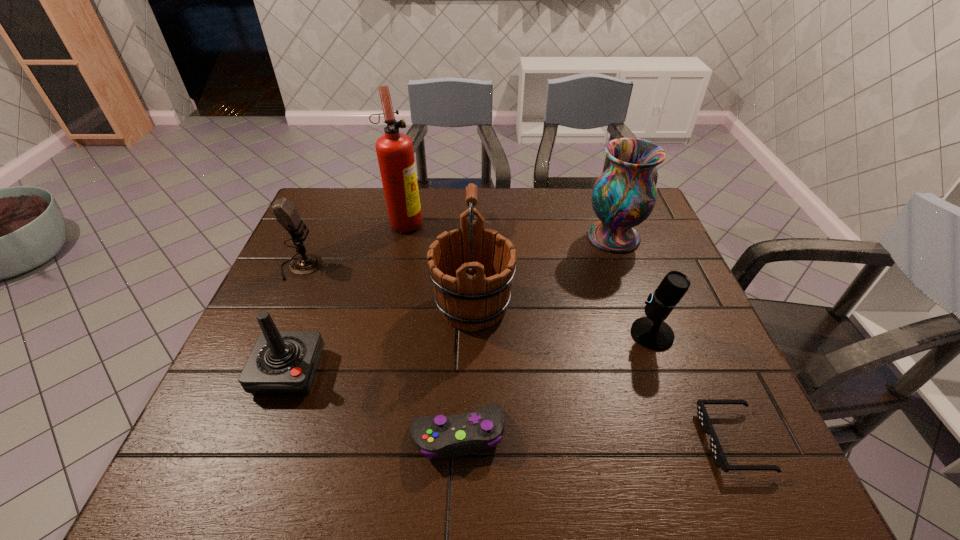
Where is `vacant space located 0.150m on the front of the sixth shortest object`? vacant space located 0.150m on the front of the sixth shortest object is located at coordinates (633, 292).

Where is `free space located on the front-facing side of the farther microphone`? Image resolution: width=960 pixels, height=540 pixels. free space located on the front-facing side of the farther microphone is located at coordinates (409, 267).

You are a GUI agent. You are given a task and a screenshot of the screen. Output one action in this format:
    pyautogui.click(x=<x>, y=<y>)
    Task: Click on the free space located 0.310m on the front of the nearer microphone
    
    Given the screenshot: What is the action you would take?
    pyautogui.click(x=708, y=485)

At what (x,y) coordinates should I click in order to perform the action: click on free space located 0.070m on the front-facing side of the joystick. Please return your answer as a coordinate pair (x, y). This screenshot has height=540, width=960. Looking at the image, I should click on click(267, 429).

Identify the location of blank space located 0.390m on the right of the control. The image size is (960, 540). (699, 435).

This screenshot has height=540, width=960. Identify the location of vacant space located 0.230m on the front-facing side of the sunglasses. (590, 441).

Where is `free location located on the front-facing side of the sunglasses`? This screenshot has width=960, height=540. free location located on the front-facing side of the sunglasses is located at coordinates (681, 441).

Locate an element on the screen. This screenshot has height=540, width=960. free space located on the front-facing side of the sunglasses is located at coordinates (535, 441).

Locate an element on the screen. This screenshot has height=540, width=960. fire extinguisher at the far edge is located at coordinates (395, 154).

Image resolution: width=960 pixels, height=540 pixels. I want to click on vase situated at the far edge, so click(x=624, y=195).